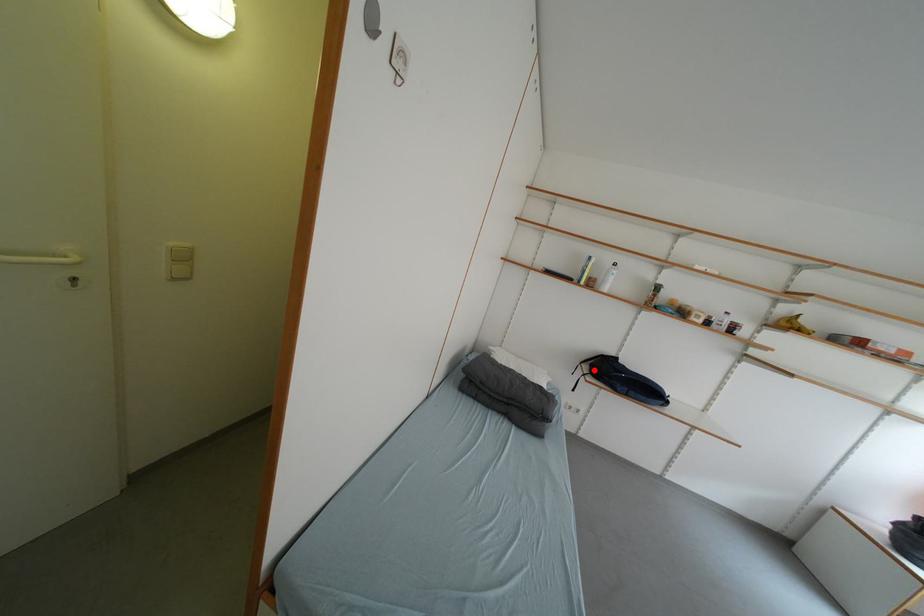
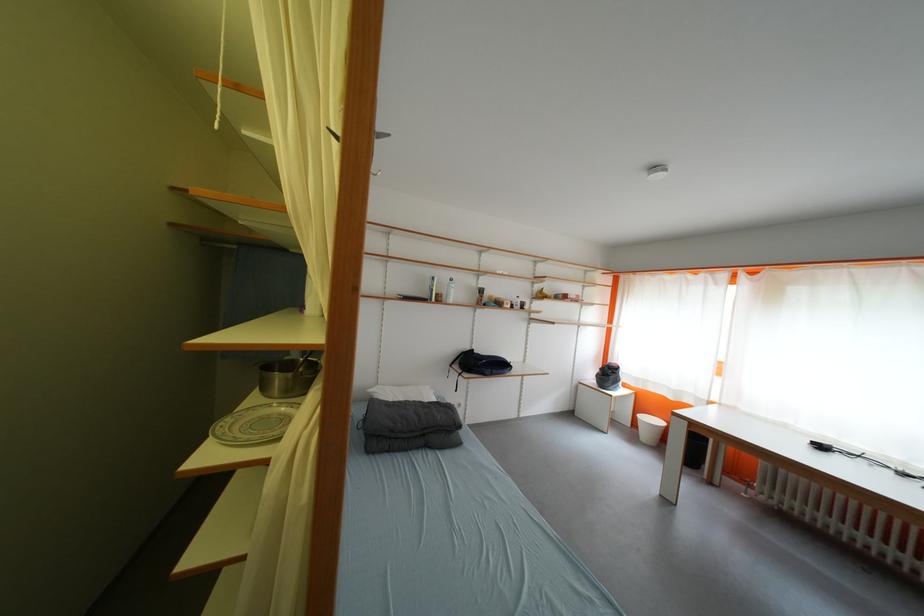
Locate, in the second image, the point that corresponds to the highlighted location in the first image.

(466, 370)